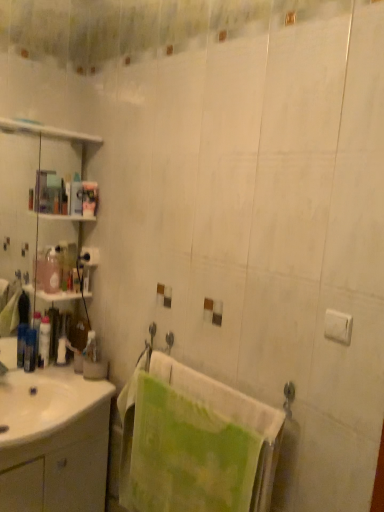
The width and height of the screenshot is (384, 512). I want to click on empty space that is to the right of translucent plastic bottle at left, the 5th toiletry positioned from the right, so click(x=54, y=372).